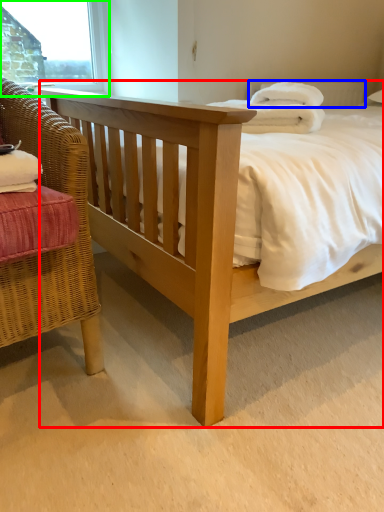
Question: Which object is the closest to the bed (highlighted by a red box)? Choose among these: pillow (highlighted by a blue box) or window frame (highlighted by a green box).

Choices:
 (A) pillow
 (B) window frame

Answer: (A)